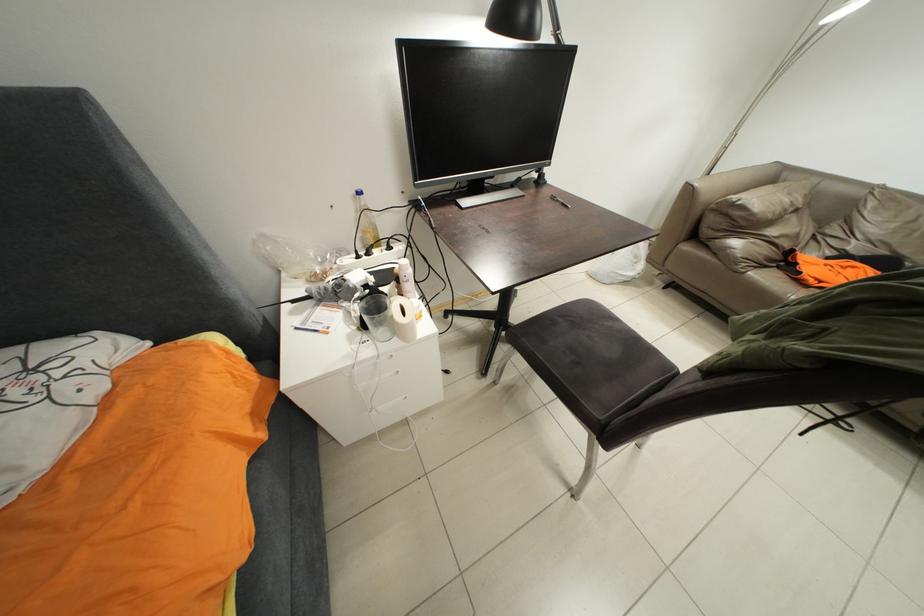
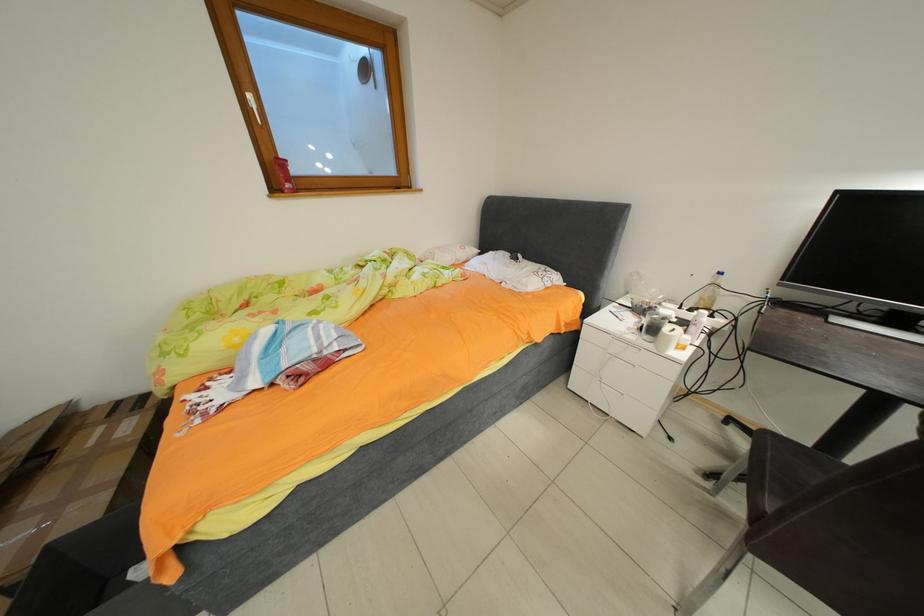
Question: The camera is either moving clockwise (left) or counter-clockwise (right) around the object. The first image is from the beginning of the video and the second image is from the end. Is the camera moving left or right when shooting the video?

Choices:
 (A) Left
 (B) Right

Answer: (B)